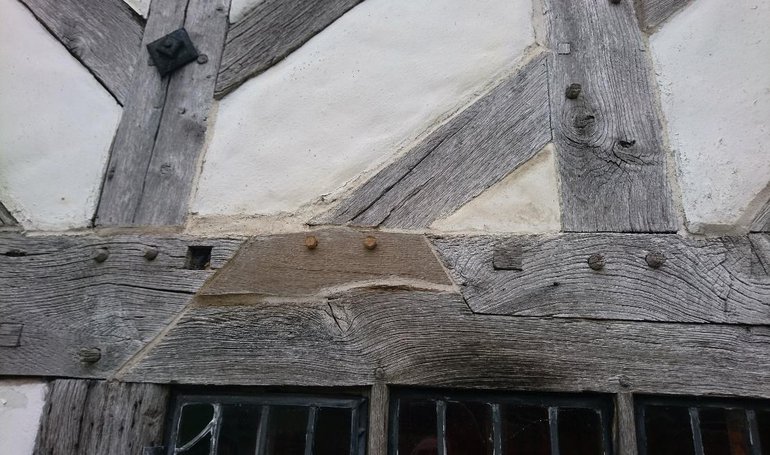
At what (x,y) coordinates should I click in order to perform the action: click on diagonal boards. Please return your answer as a coordinate pair (x, y). Looking at the image, I should click on (94, 27), (275, 37), (464, 171), (653, 4), (751, 212), (1, 212).